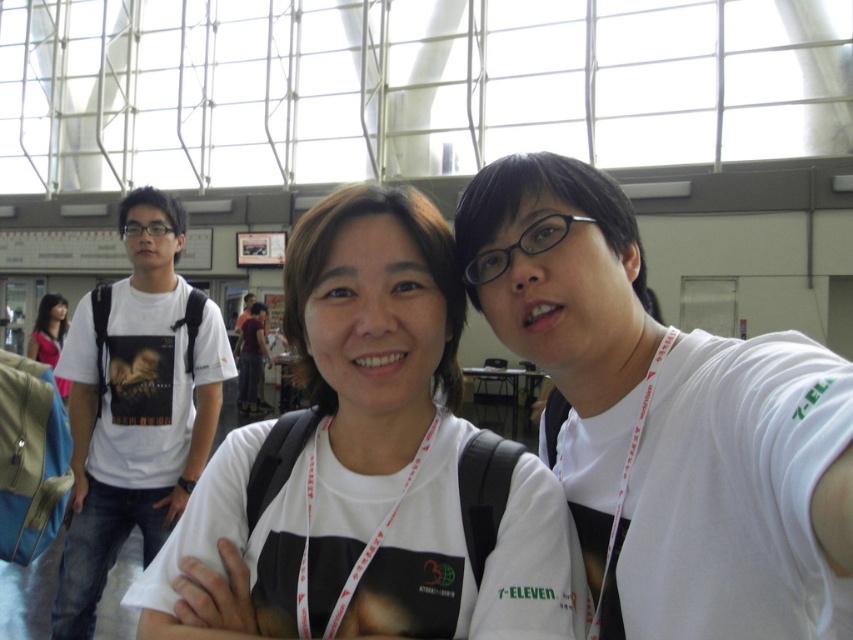
Does white matte t-shirt at center come in front of white t-shirt at left?

Yes, white matte t-shirt at center is in front of white t-shirt at left.

Which is more to the left, white matte t-shirt at center or white t-shirt at left?

From the viewer's perspective, white t-shirt at left appears more on the left side.

Which is in front, point (329, 401) or point (213, 424)?

Point (329, 401) is more forward.

Locate an element on the screen. Image resolution: width=853 pixels, height=640 pixels. white matte t-shirt at center is located at coordinates (370, 461).

Is white t-shirt at left above matte black hair at upper left?

No.

Is white t-shirt at left below matte black hair at upper left?

Indeed, white t-shirt at left is positioned under matte black hair at upper left.

Which is in front, point (177, 508) or point (39, 323)?

Point (177, 508) is in front.

Identify the location of white t-shirt at left. (135, 404).

Is point (560, 506) positioned in front of point (33, 356)?

Yes, point (560, 506) is in front of point (33, 356).

Does point (321, 340) come closer to viewer compared to point (30, 332)?

Yes, point (321, 340) is closer to viewer.

Where is `white matte t-shirt at center`? The image size is (853, 640). white matte t-shirt at center is located at coordinates (370, 461).